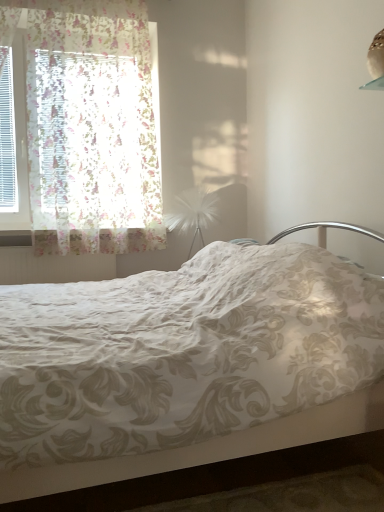
Find the location of a particular element. This screenshot has height=512, width=384. white floral fabric bed at center is located at coordinates (185, 366).

Locate an element on the screen. This screenshot has height=512, width=384. metallic silver headboard at upper right is located at coordinates (326, 231).

From a real-world perspective, is white floral fabric bed at center under white textured radiator at lower left?

Yes, from a real-world perspective, white floral fabric bed at center is below white textured radiator at lower left.

Which of these two, white floral fabric bed at center or white textured radiator at lower left, stands shorter?

With less height is white textured radiator at lower left.

Locate an element on the screen. This screenshot has width=384, height=512. bed below the white textured radiator at lower left (from the image's perspective) is located at coordinates (185, 366).

From a real-world perspective, is white feather at center on white textured radiator at lower left?

Correct, in the physical world, white feather at center is higher than white textured radiator at lower left.

Are white feather at center and white textured radiator at lower left far apart?

That's not correct — white feather at center is a little close to white textured radiator at lower left.

From the image's perspective, which is above, white feather at center or white textured radiator at lower left?

white feather at center, from the image's perspective.

Between white feather at center and white textured radiator at lower left, which one appears on the left side from the viewer's perspective?

white textured radiator at lower left is more to the left.

Would you say pearl white feather at upper right contains white feather at center?

No, white feather at center is not inside pearl white feather at upper right.

Is pearl white feather at upper right aimed at white feather at center?

A: No.

Are pearl white feather at upper right and white feather at center making contact?

No, pearl white feather at upper right is not beside white feather at center.

From a real-world perspective, is pearl white feather at upper right located beneath white feather at center?

Incorrect, from a real-world perspective, pearl white feather at upper right is higher than white feather at center.

From a real-world perspective, which object rests below the other?

white textured radiator at lower left, from a real-world perspective.

Is white textured radiator at lower left aimed at pearl white feather at upper right?

No, white textured radiator at lower left is not turned towards pearl white feather at upper right.

Can you confirm if white textured radiator at lower left is bigger than pearl white feather at upper right?

Indeed, white textured radiator at lower left has a larger size compared to pearl white feather at upper right.

Find the location of a particular element. radiator behind the pearl white feather at upper right is located at coordinates (53, 267).

From the image's perspective, relative to white textured radiator at lower left, is floral lace curtain at left above or below?

floral lace curtain at left is above white textured radiator at lower left.

Is floral lace curtain at left facing towards white textured radiator at lower left?

No, floral lace curtain at left is not oriented towards white textured radiator at lower left.

From a real-world perspective, is pearl white feather at upper right physically below metallic silver headboard at upper right?

Incorrect, from a real-world perspective, pearl white feather at upper right is higher than metallic silver headboard at upper right.

Is pearl white feather at upper right thinner than metallic silver headboard at upper right?

Indeed, pearl white feather at upper right has a lesser width compared to metallic silver headboard at upper right.

Is metallic silver headboard at upper right completely or partially inside pearl white feather at upper right?

No.

Can you confirm if pearl white feather at upper right is bigger than metallic silver headboard at upper right?

No, pearl white feather at upper right is not bigger than metallic silver headboard at upper right.

Considering the positions of objects white textured radiator at lower left and floral lace curtain at left in the image provided, who is behind, white textured radiator at lower left or floral lace curtain at left?

white textured radiator at lower left.

From the image's perspective, between white textured radiator at lower left and floral lace curtain at left, who is located below?

white textured radiator at lower left, from the image's perspective.

Is white textured radiator at lower left directly adjacent to floral lace curtain at left?

white textured radiator at lower left is not next to floral lace curtain at left, and they're not touching.

Is white textured radiator at lower left oriented towards floral lace curtain at left?

No.

Where is `bed in front of the white textured radiator at lower left`? bed in front of the white textured radiator at lower left is located at coordinates (185, 366).

Identify the location of radiator below the white feather at center (from a real-world perspective). The width and height of the screenshot is (384, 512). (53, 267).

From the image, which object appears to be farther from white feather at center, floral lace curtain at left or white textured radiator at lower left?

white textured radiator at lower left.

Looking at the image, which one is located closer to metallic silver headboard at upper right, white feather at center or floral lace curtain at left?

white feather at center.

Based on their spatial positions, is white feather at center or white textured radiator at lower left closer to pearl white feather at upper right?

The object closer to pearl white feather at upper right is white feather at center.

Looking at the image, which one is located closer to white floral fabric bed at center, white feather at center or pearl white feather at upper right?

pearl white feather at upper right lies closer to white floral fabric bed at center than the other object.

Looking at this image, looking at the image, which one is located further to white feather at center, metallic silver headboard at upper right or floral lace curtain at left?

metallic silver headboard at upper right.

Considering their positions, is floral lace curtain at left positioned closer to pearl white feather at upper right than white textured radiator at lower left?

Among the two, floral lace curtain at left is located nearer to pearl white feather at upper right.

Looking at the image, which one is located closer to white textured radiator at lower left, white feather at center or floral lace curtain at left?

Among the two, floral lace curtain at left is located nearer to white textured radiator at lower left.

Estimate the real-world distances between objects in this image. Which object is closer to floral lace curtain at left, white floral fabric bed at center or white feather at center?

white feather at center is positioned closer to the anchor floral lace curtain at left.

In order to click on headboard between white textured radiator at lower left and pearl white feather at upper right in the horizontal direction in this screenshot , I will do `click(326, 231)`.

Identify the location of radiator between metallic silver headboard at upper right and white feather at center from front to back. The height and width of the screenshot is (512, 384). (53, 267).

The height and width of the screenshot is (512, 384). I want to click on headboard located between floral lace curtain at left and pearl white feather at upper right in the left-right direction, so click(326, 231).

At what (x,y) coordinates should I click in order to perform the action: click on lamp between white floral fabric bed at center and white feather at center along the z-axis. Please return your answer as a coordinate pair (x, y). The image size is (384, 512). Looking at the image, I should click on (376, 63).